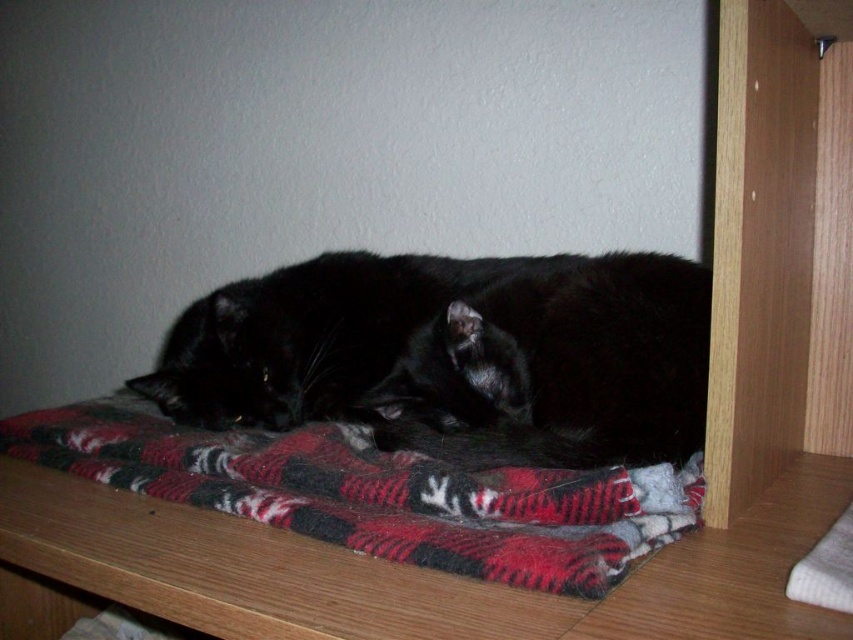
Can you confirm if black fuzzy cat at center is smaller than red plaid blanket at center?

No.

Is black fuzzy cat at center further to camera compared to red plaid blanket at center?

Yes, it is behind red plaid blanket at center.

What do you see at coordinates (456, 355) in the screenshot?
I see `black fuzzy cat at center` at bounding box center [456, 355].

In order to click on black fuzzy cat at center in this screenshot , I will do `click(456, 355)`.